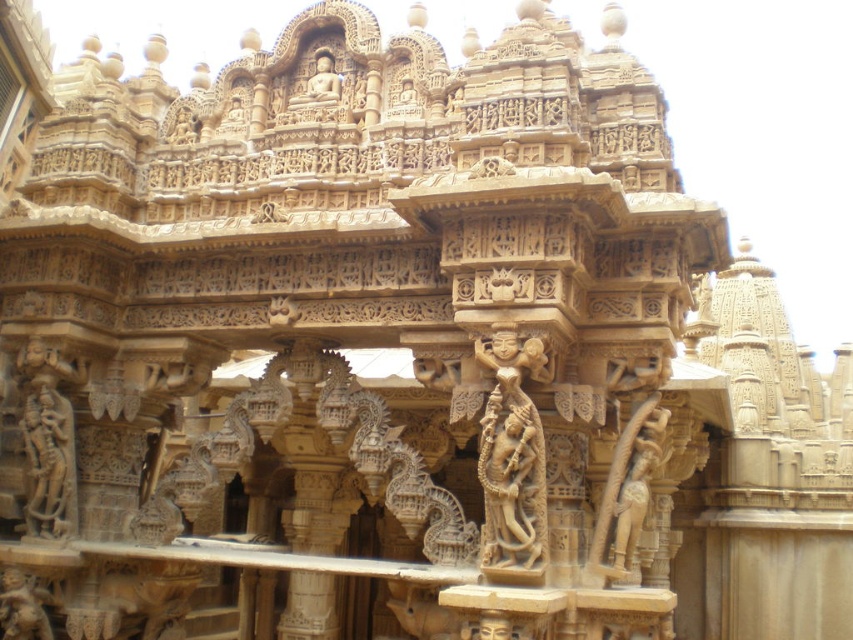
Based on the scene description, where is the beige stone sculpture at center located in terms of coordinates?

The beige stone sculpture at center is located at point coordinates of (512, 460).

You are an art conservator examining the temple structure. You notice two central statues, the beige stone sculpture at center and the golden sandstone statue at center. Which one is positioned closer to the front of the structure?

The beige stone sculpture at center is closer to the viewer than the golden sandstone statue at center, so it is positioned closer to the front of the structure.

Based on the photo, you are an archaeologist standing at the center of the temple structure. You want to locate the golden sandstone statue at lower left. Based on the coordinates provided, in which direction should you move to find it?

The golden sandstone statue at lower left is located at coordinates point (22, 605), which means it is positioned to the far right and slightly downward from your current position at the center. You should move towards the far right and slightly downward direction to locate it.